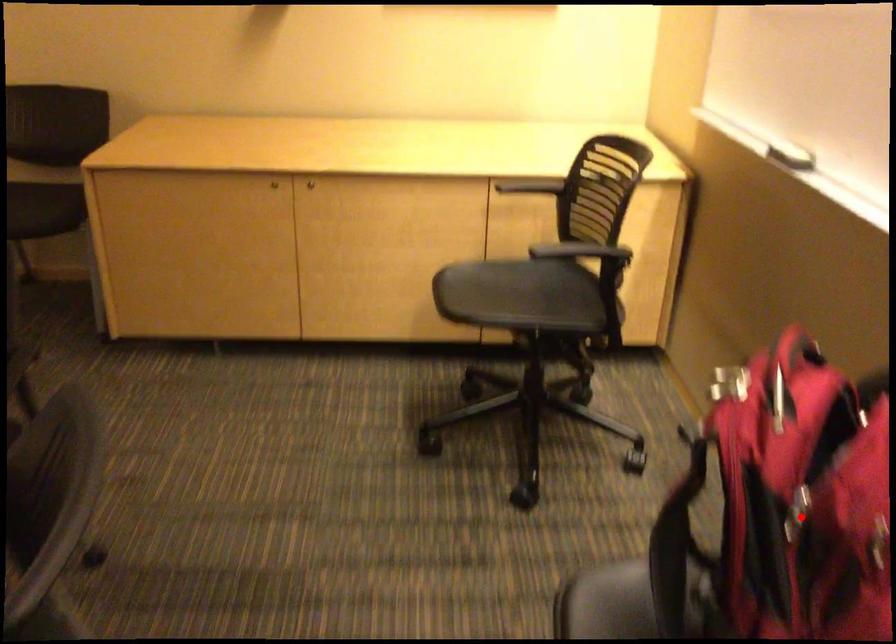
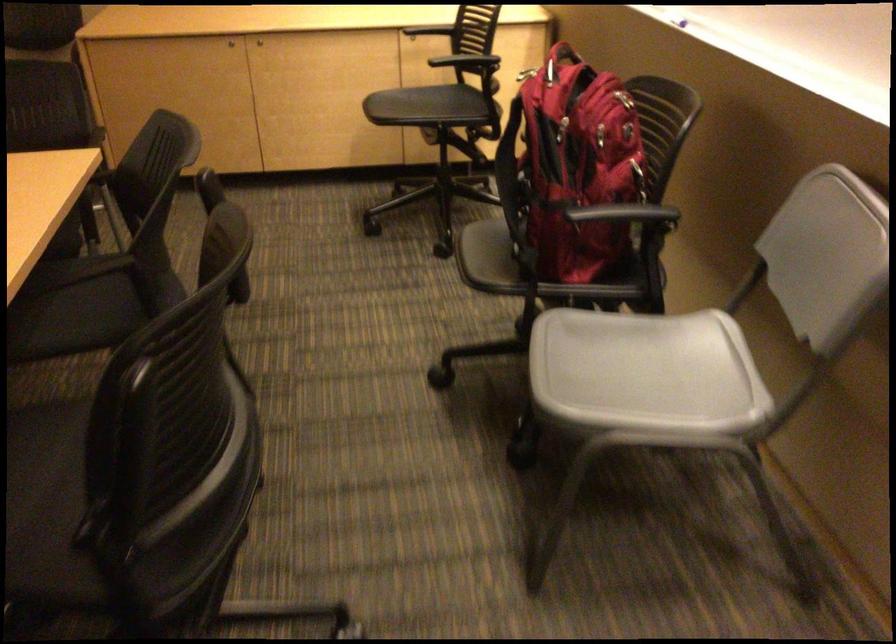
Question: I am providing you with two images of the same scene from different viewpoints. Given a red point in image1, look at the same physical point in image2. Is it:

Choices:
 (A) Closer to the viewpoint
 (B) Farther from the viewpoint

Answer: (B)